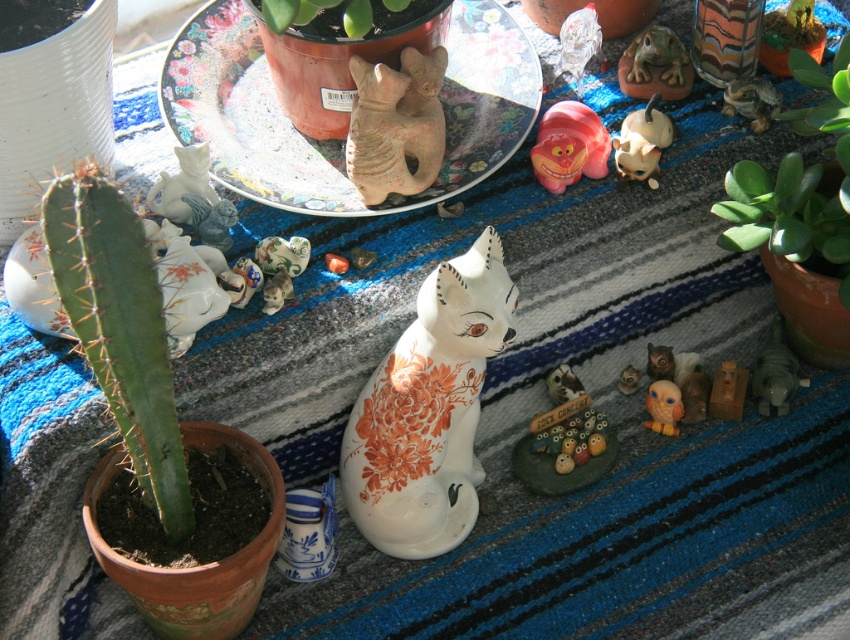
You have two cats on a table, a white glossy ceramic cat at center and a matte clay cat at center. Which one is wider?

The white glossy ceramic cat at center is wider than the matte clay cat at center according to the description.

You are setting up a display on a striped rug with a white glossy ceramic cat at center and a matte clay cat at center. Which cat is more to the right?

The white glossy ceramic cat at center is positioned on the right side of the matte clay cat at center, so it is more to the right.

You are setting up a shelf in your home and want to place the white glossy ceramic cat at center and the green matte plant at upper center. Since you want them to appear balanced in height, which object should you place on a higher shelf?

The white glossy ceramic cat at center is much taller than the green matte plant at upper center, so to balance their heights, you should place the green matte plant at upper center on a higher shelf to match the height of the cat.